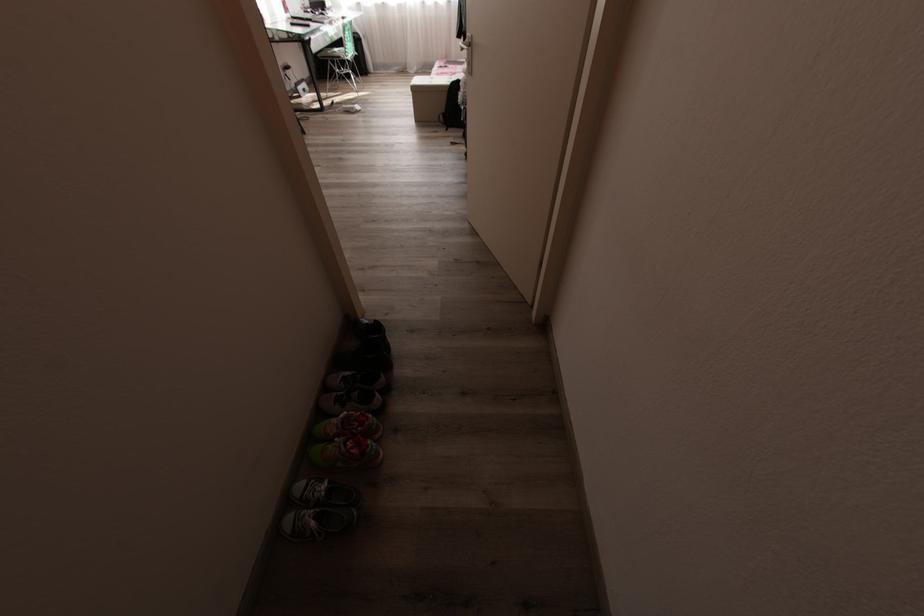
What do you see at coordinates (349, 400) in the screenshot? I see `the black shoe` at bounding box center [349, 400].